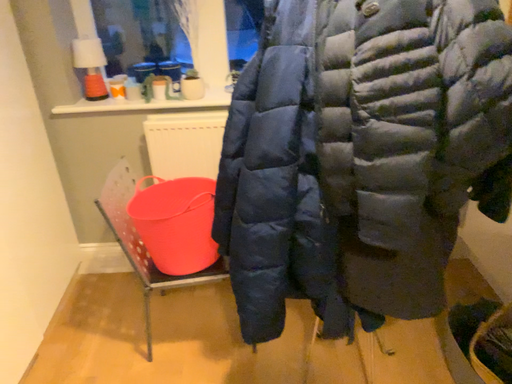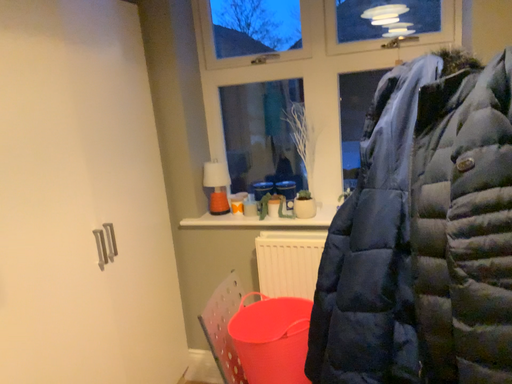
Question: Which way did the camera rotate in the video?

Choices:
 (A) rotated upward
 (B) rotated downward

Answer: (A)